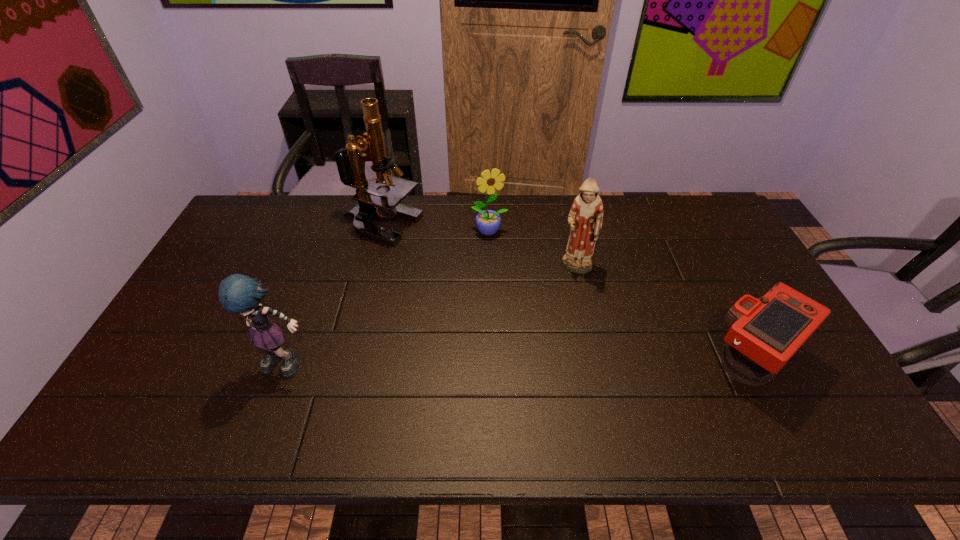
Where is `object that can be found as the second closest to the rightmost object`? This screenshot has height=540, width=960. object that can be found as the second closest to the rightmost object is located at coordinates (488, 222).

Find the location of a particular element. object that is the fourth closest to the shortest object is located at coordinates (239, 294).

This screenshot has height=540, width=960. In order to click on vacant position in the image that satisfies the following two spatial constraints: 1. on the front side of the third object from left to right; 2. on the left side of the camera in this screenshot , I will do (492, 361).

Identify the location of vacant region that satisfies the following two spatial constraints: 1. on the front side of the figurine; 2. on the right side of the tallest object. The image size is (960, 540). 370,270.

Locate an element on the screen. Image resolution: width=960 pixels, height=540 pixels. free location that satisfies the following two spatial constraints: 1. on the front side of the figurine; 2. on the left side of the second shortest object is located at coordinates (491, 270).

What are the coordinates of `free space that satisfies the following two spatial constraints: 1. on the front side of the microscope; 2. on the left side of the second object from right to left` in the screenshot? It's located at (370, 270).